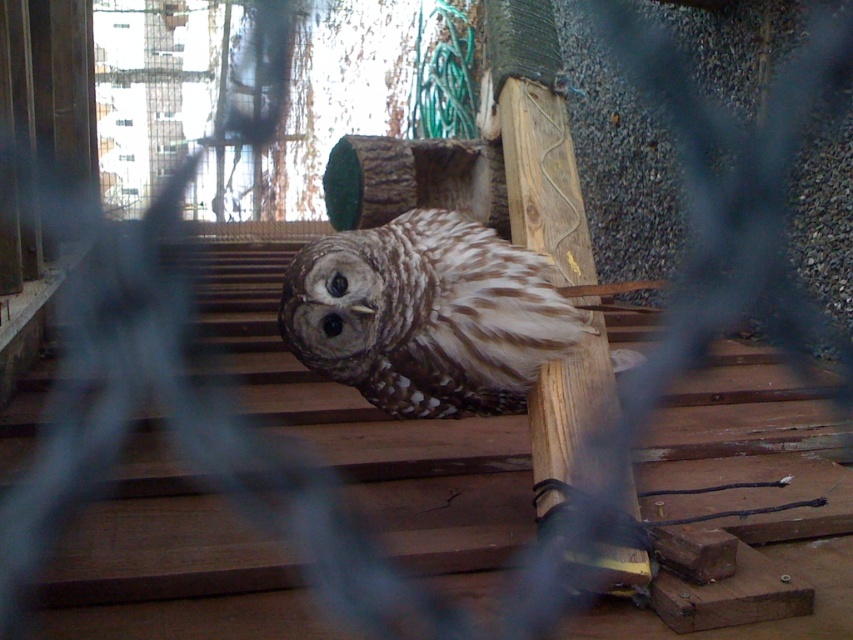
Question: Which object appears closest to the camera in this image?

Choices:
 (A) brown speckled feathers at center
 (B) brown wood stairs at center

Answer: (B)

Question: Is brown wood stairs at center thinner than brown speckled feathers at center?

Choices:
 (A) yes
 (B) no

Answer: (B)

Question: Among these objects, which one is farthest from the camera?

Choices:
 (A) brown wood stairs at center
 (B) brown speckled feathers at center

Answer: (B)

Question: Which of the following is the farthest from the observer?

Choices:
 (A) (10, 476)
 (B) (543, 358)

Answer: (A)

Question: Does brown wood stairs at center have a lesser width compared to brown speckled feathers at center?

Choices:
 (A) yes
 (B) no

Answer: (B)

Question: Can you confirm if brown wood stairs at center is positioned below brown speckled feathers at center?

Choices:
 (A) no
 (B) yes

Answer: (B)